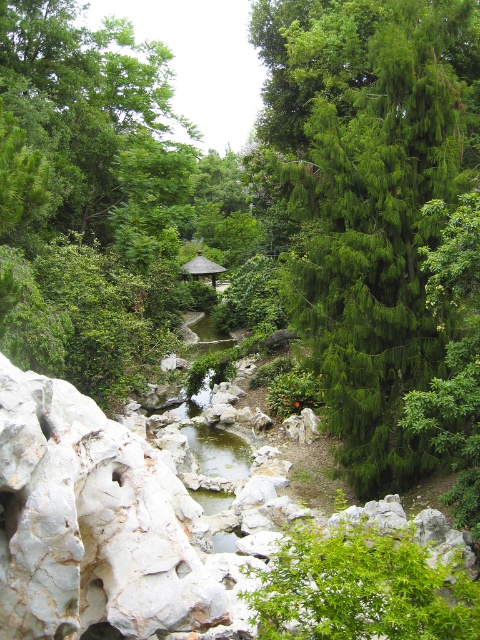
Is point (404, 390) positioned before point (447, 632)?

That is False.

Is green needle-like tree at center-right bigger than green leafy bush at center?

Yes, green needle-like tree at center-right is bigger than green leafy bush at center.

Describe the element at coordinates (369, 196) in the screenshot. I see `green needle-like tree at center-right` at that location.

I want to click on green needle-like tree at center-right, so click(x=369, y=196).

Does green needle-like tree at center-right have a greater width compared to wooden thatched roof gazebo at center?

Indeed, green needle-like tree at center-right has a greater width compared to wooden thatched roof gazebo at center.

Locate an element on the screen. The height and width of the screenshot is (640, 480). green needle-like tree at center-right is located at coordinates (369, 196).

At what (x,y) coordinates should I click in order to perform the action: click on green needle-like tree at center-right. Please return your answer as a coordinate pair (x, y). Looking at the image, I should click on (369, 196).

This screenshot has width=480, height=640. I want to click on green needle-like tree at center-right, so [x=369, y=196].

Is white marble rock at center further to camera compared to green leafy bush at center?

Yes.

Is point (151, 531) farther from viewer compared to point (388, 536)?

No, it is in front of (388, 536).

Does point (74, 420) lie behind point (391, 547)?

That is True.

The width and height of the screenshot is (480, 640). Find the location of `white marble rock at center`. white marble rock at center is located at coordinates (91, 522).